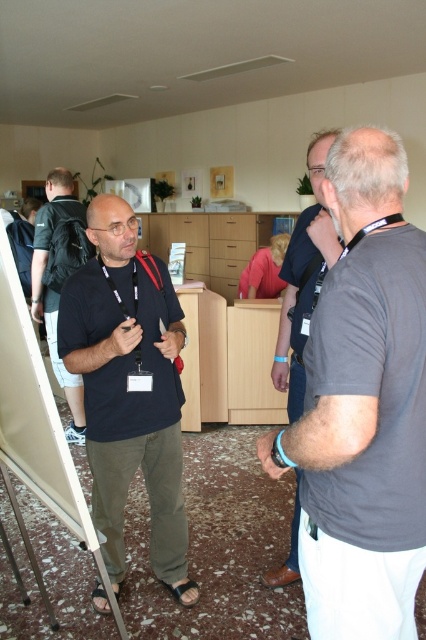
Which is more to the left, black matte shirt at center or white matte easel at center?

From the viewer's perspective, white matte easel at center appears more on the left side.

Who is more forward, (x=100, y=609) or (x=23, y=458)?

Positioned in front is point (x=23, y=458).

This screenshot has height=640, width=426. Find the location of `black matte shirt at center`. black matte shirt at center is located at coordinates (129, 390).

Does point (189, 579) lie in front of point (291, 394)?

No, (189, 579) is behind (291, 394).

Does black matte shirt at center come in front of gray fabric shirt at center?

No, black matte shirt at center is further to the viewer.

Is point (97, 323) closer to camera compared to point (322, 148)?

No.

You are a GUI agent. You are given a task and a screenshot of the screen. Output one action in this format:
    pyautogui.click(x=<x>, y=<y>)
    Task: Click on the black matte shirt at center
    
    Given the screenshot: What is the action you would take?
    pyautogui.click(x=129, y=390)

Identify the location of gray fabric shirt at center. This screenshot has width=426, height=640. (304, 278).

Is gray fabric shirt at center further to camera compared to matte black shirt at left?

No, gray fabric shirt at center is closer to the viewer.

Where is `gray fabric shirt at center`? The height and width of the screenshot is (640, 426). gray fabric shirt at center is located at coordinates (304, 278).

At what (x,y) coordinates should I click in order to perform the action: click on gray fabric shirt at center. Please return your answer as a coordinate pair (x, y). The image size is (426, 640). Looking at the image, I should click on (304, 278).